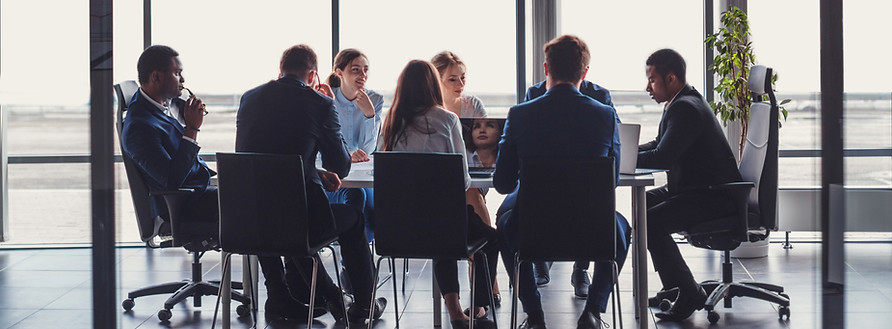
Find the location of a particular element. The height and width of the screenshot is (329, 892). chairs is located at coordinates (565, 191), (426, 209), (283, 210), (135, 210), (741, 220).